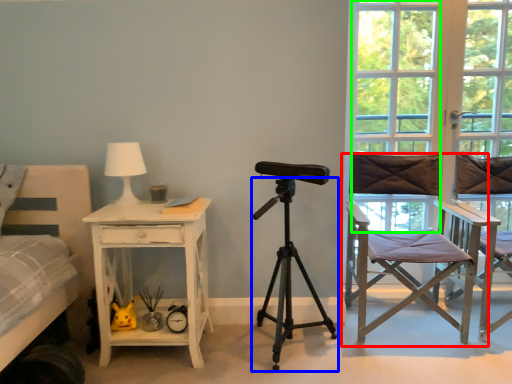
Question: Which object is positioned farthest from chair (highlighted by a red box)? Select from tripod (highlighted by a blue box) and window (highlighted by a green box).

Choices:
 (A) tripod
 (B) window

Answer: (B)